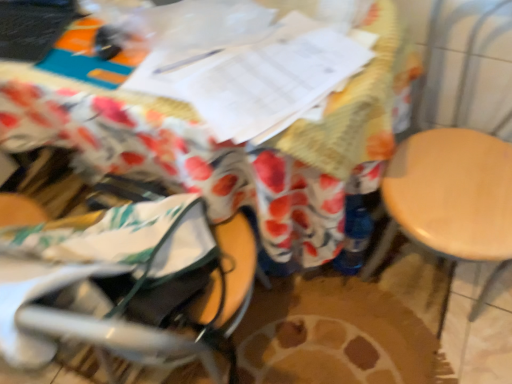
Question: Does wooden table at center lie behind light wood swivel chair at right?

Choices:
 (A) no
 (B) yes

Answer: (B)

Question: Would you say wooden table at center is outside light wood swivel chair at right?

Choices:
 (A) no
 (B) yes

Answer: (B)

Question: Considering the relative sizes of wooden table at center and light wood swivel chair at right in the image provided, is wooden table at center smaller than light wood swivel chair at right?

Choices:
 (A) no
 (B) yes

Answer: (A)

Question: Does wooden table at center have a greater height compared to light wood swivel chair at right?

Choices:
 (A) yes
 (B) no

Answer: (B)

Question: Is wooden table at center beside light wood swivel chair at right?

Choices:
 (A) no
 (B) yes

Answer: (A)

Question: Is wooden table at center wider or thinner than gray fabric baby carriage at lower left?

Choices:
 (A) wide
 (B) thin

Answer: (A)

Question: From a real-world perspective, is wooden table at center above or below gray fabric baby carriage at lower left?

Choices:
 (A) above
 (B) below

Answer: (B)

Question: From their relative heights in the image, would you say wooden table at center is taller or shorter than gray fabric baby carriage at lower left?

Choices:
 (A) short
 (B) tall

Answer: (B)

Question: Considering the relative positions of wooden table at center and gray fabric baby carriage at lower left in the image provided, is wooden table at center to the left or to the right of gray fabric baby carriage at lower left?

Choices:
 (A) right
 (B) left

Answer: (A)

Question: Would you say light wood swivel chair at right is to the left or to the right of gray fabric baby carriage at lower left in the picture?

Choices:
 (A) right
 (B) left

Answer: (A)

Question: Does point (425, 61) appear closer or farther from the camera than point (44, 317)?

Choices:
 (A) closer
 (B) farther

Answer: (B)

Question: Is light wood swivel chair at right in front of or behind gray fabric baby carriage at lower left in the image?

Choices:
 (A) front
 (B) behind

Answer: (A)

Question: In terms of height, does light wood swivel chair at right look taller or shorter compared to gray fabric baby carriage at lower left?

Choices:
 (A) short
 (B) tall

Answer: (B)

Question: Would you say gray fabric baby carriage at lower left is to the left or to the right of light wood swivel chair at right in the picture?

Choices:
 (A) left
 (B) right

Answer: (A)

Question: Looking at the image, does gray fabric baby carriage at lower left seem bigger or smaller compared to light wood swivel chair at right?

Choices:
 (A) big
 (B) small

Answer: (B)